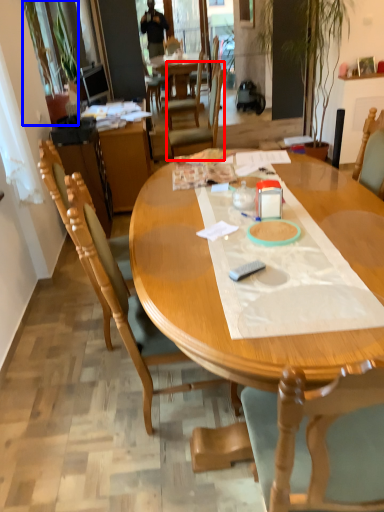
Question: Which object is further to the camera taking this photo, chair (highlighted by a red box) or houseplant (highlighted by a blue box)?

Choices:
 (A) chair
 (B) houseplant

Answer: (A)